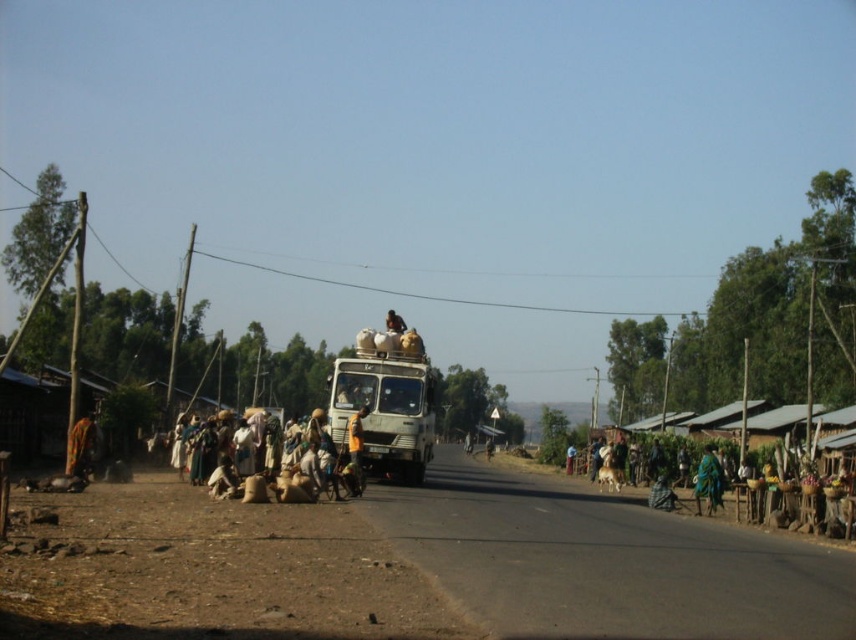
Question: Which point is closer to the camera?

Choices:
 (A) teal fabric person at lower right
 (B) white fabric people at lower left
 (C) orange fabric person at center
 (D) green matte truck at center

Answer: (B)

Question: Among these points, which one is farthest from the camera?

Choices:
 (A) (94, 429)
 (B) (700, 460)

Answer: (B)

Question: Does green matte truck at center appear on the left side of teal fabric person at lower right?

Choices:
 (A) yes
 (B) no

Answer: (A)

Question: Which object is farther from the camera taking this photo?

Choices:
 (A) white fabric people at lower left
 (B) orange fabric person at center

Answer: (B)

Question: Does teal fabric person at lower right lie in front of orange fabric person at center?

Choices:
 (A) yes
 (B) no

Answer: (B)

Question: Can you confirm if white fabric people at lower left is wider than orange fabric person at center?

Choices:
 (A) no
 (B) yes

Answer: (B)